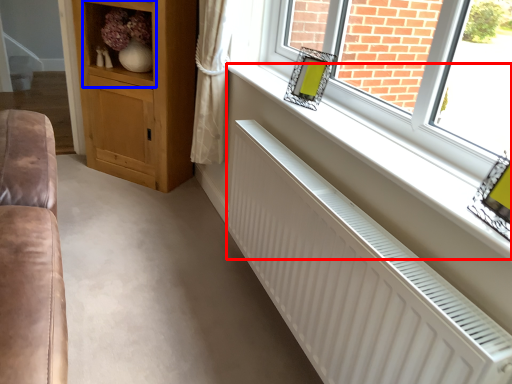
Question: Which object appears closest to the camera in this image, window sill (highlighted by a red box) or shelf (highlighted by a blue box)?

Choices:
 (A) window sill
 (B) shelf

Answer: (A)